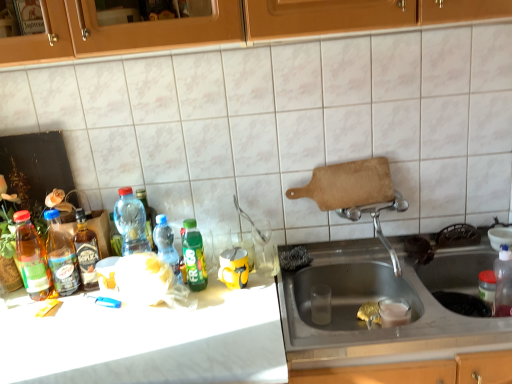
This screenshot has width=512, height=384. I want to click on vacant area to the left of translucent glass bottle at left, the fifth bottle when ordered from right to left, so click(x=26, y=306).